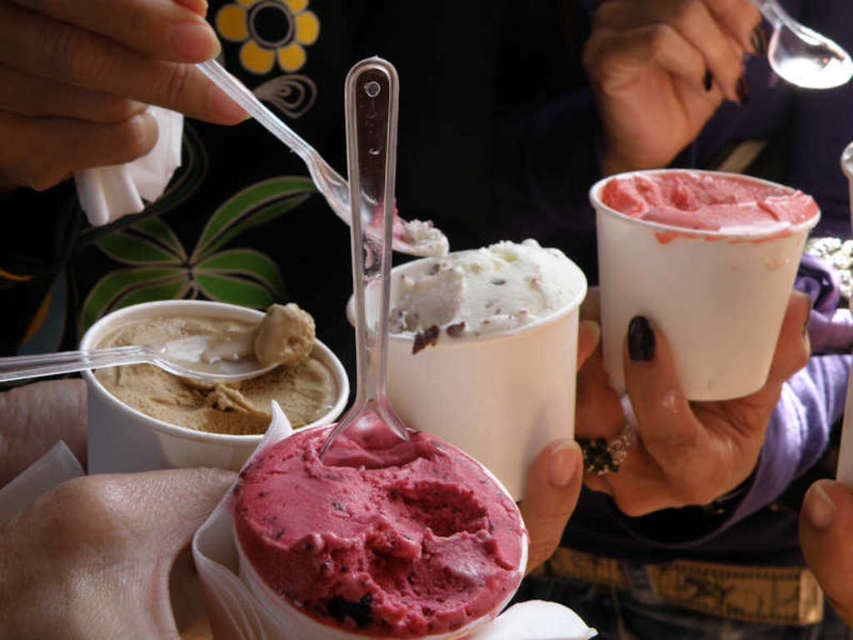
Can you confirm if black nail polish at upper right is taller than smooth chocolate chip ice cream at center?

Indeed, black nail polish at upper right has a greater height compared to smooth chocolate chip ice cream at center.

From the picture: Which is more to the left, black nail polish at upper right or smooth chocolate chip ice cream at center?

Positioned to the left is smooth chocolate chip ice cream at center.

Does point (781, 333) lie behind point (460, 314)?

That is True.

The image size is (853, 640). Identify the location of black nail polish at upper right. [676, 422].

Describe the element at coordinates (699, 269) in the screenshot. I see `smooth strawberry ice cream at upper right` at that location.

Does point (660, 308) come closer to viewer compared to point (695, 108)?

Yes, point (660, 308) is closer to viewer.

Describe the element at coordinates (699, 269) in the screenshot. I see `smooth strawberry ice cream at upper right` at that location.

The image size is (853, 640). I want to click on smooth strawberry ice cream at upper right, so click(699, 269).

Which is in front, point (711, 182) or point (64, 608)?

Point (64, 608) is in front.

Can you confirm if smooth strawberry ice cream at upper right is positioned below pink matte skin at lower left?

Incorrect, smooth strawberry ice cream at upper right is not positioned below pink matte skin at lower left.

Is point (746, 332) positioned before point (78, 573)?

That is False.

The height and width of the screenshot is (640, 853). In order to click on smooth strawberry ice cream at upper right in this screenshot , I will do `click(699, 269)`.